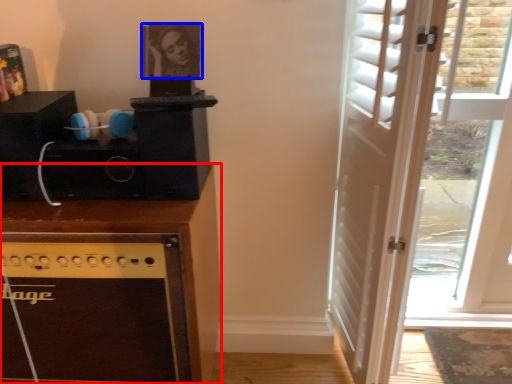
Question: Which object is closer to the camera taking this photo, cabinetry (highlighted by a red box) or picture frame (highlighted by a blue box)?

Choices:
 (A) cabinetry
 (B) picture frame

Answer: (A)